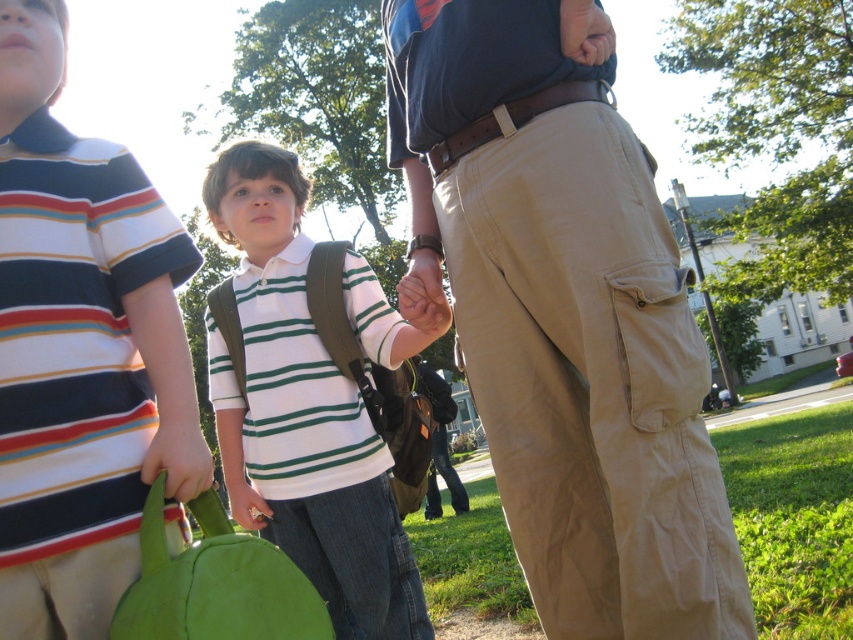
You are a photographer trying to capture a group photo of the striped cotton shirt at left and the matte green bag at lower left. The camera frame can only accommodate objects up to the width of the wider object. Which object determines the minimum required frame width?

The striped cotton shirt at left has a larger width than the matte green bag at lower left, so the frame width must be at least as wide as the striped cotton shirt at left to accommodate both objects.